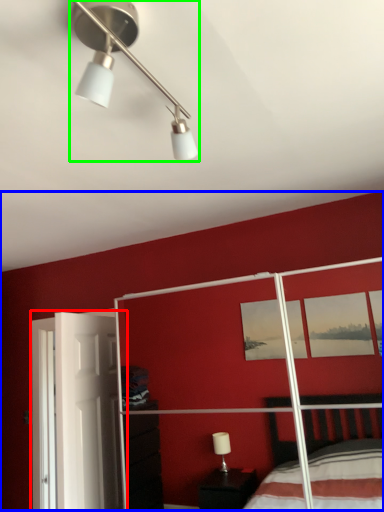
Question: Which object is the farthest from screen door (highlighted by a red box)? Choose among these: backdrop (highlighted by a blue box) or lamp (highlighted by a green box).

Choices:
 (A) backdrop
 (B) lamp

Answer: (B)